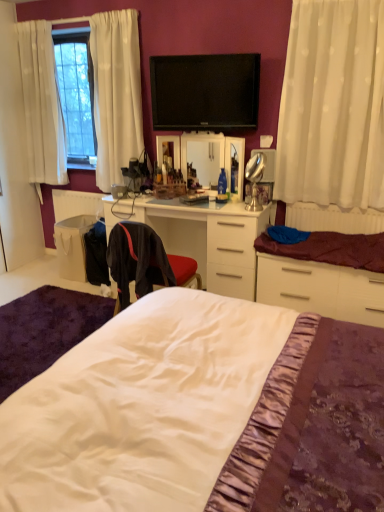
Identify the location of blank space above matte white mirror at center (from a real-world perspective). (200, 129).